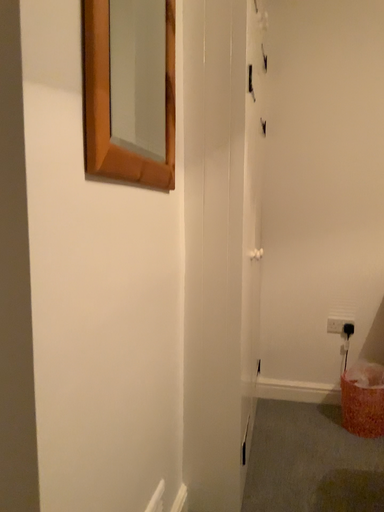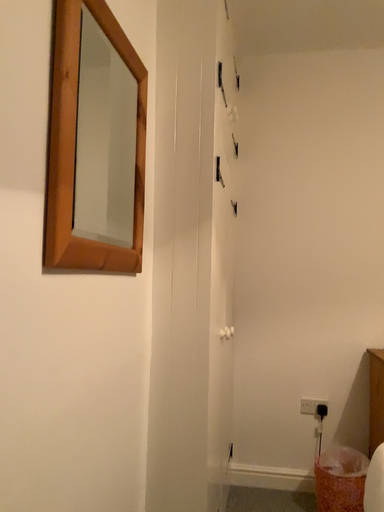
Question: How did the camera likely rotate when shooting the video?

Choices:
 (A) rotated downward
 (B) rotated upward

Answer: (B)